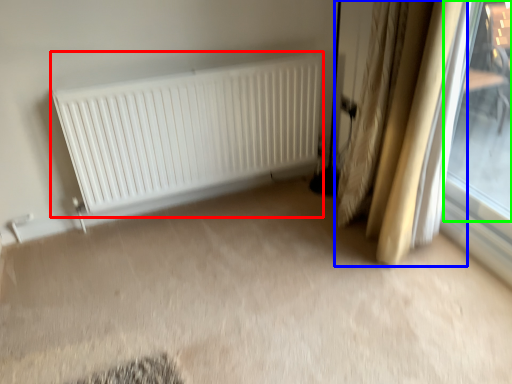
Question: Which is farther away from radiator (highlighted by a red box)? curtain (highlighted by a blue box) or window (highlighted by a green box)?

Choices:
 (A) curtain
 (B) window

Answer: (B)